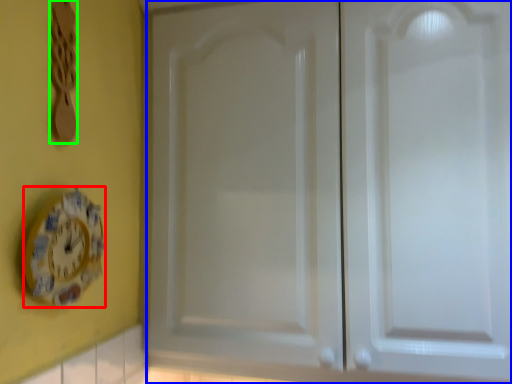
Question: Considering the real-world distances, which object is closest to clock (highlighted by a red box)? door (highlighted by a blue box) or spoon (highlighted by a green box).

Choices:
 (A) door
 (B) spoon

Answer: (B)